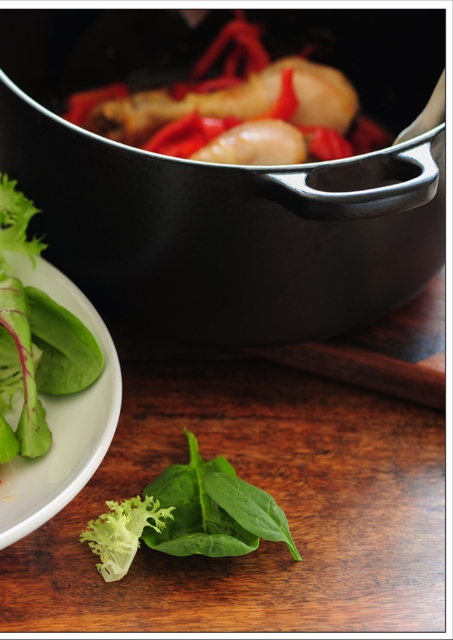
You are preparing a meal and need to transfer the contents from the black matte frying pan at upper center to the green leafy plate at lower left. However, you notice the frying pan is placed over the plate. Can you safely move the frying pan without spilling?

The black matte frying pan at upper center is positioned over the green leafy plate at lower left, so you can carefully lift the frying pan and move it away from the plate to transfer the contents safely without spilling.

Looking at this image, you are a chef standing at the counter and want to reach the point at coordinates point (382, 243). Your hand can extend 70 centimeters. Can you reach it?

The distance of point (382, 243) from camera is 74.58 centimeters, so your hand cannot reach it since it can only extend 70 centimeters.

You are a chef trying to place a cutting board on the wooden surface in the foreground. Given the black matte frying pan at upper center is located at coordinates 0.311 on the x and 0.453 on the y axis, where should you place the cutting board to avoid overlapping with it?

The black matte frying pan at upper center is located at coordinates 0.311 on the x and 0.453 on the y axis, so place the cutting board away from those coordinates to avoid overlapping.